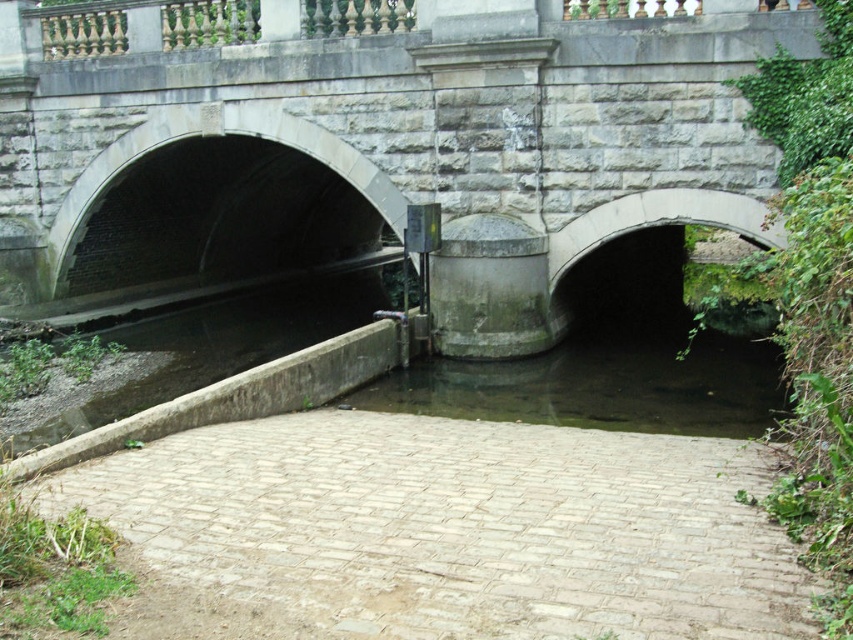
Who is shorter, clear water at center or dark gray concrete water at lower left?

clear water at center is shorter.

Is clear water at center smaller than dark gray concrete water at lower left?

Yes, clear water at center is smaller than dark gray concrete water at lower left.

Which is behind, point (468, 371) or point (161, 333)?

Point (161, 333)

This screenshot has height=640, width=853. Find the location of `clear water at center`. clear water at center is located at coordinates [x=608, y=380].

Who is taller, stone bridge at center or clear water at center?

stone bridge at center

Does stone bridge at center have a greater height compared to clear water at center?

Yes.

Where is `stone bridge at center`? The width and height of the screenshot is (853, 640). stone bridge at center is located at coordinates (363, 131).

Who is shorter, light beige brick path at center or dark gray concrete water at lower left?

light beige brick path at center

Does light beige brick path at center appear on the right side of dark gray concrete water at lower left?

Correct, you'll find light beige brick path at center to the right of dark gray concrete water at lower left.

Identify the location of light beige brick path at center. This screenshot has height=640, width=853. (457, 525).